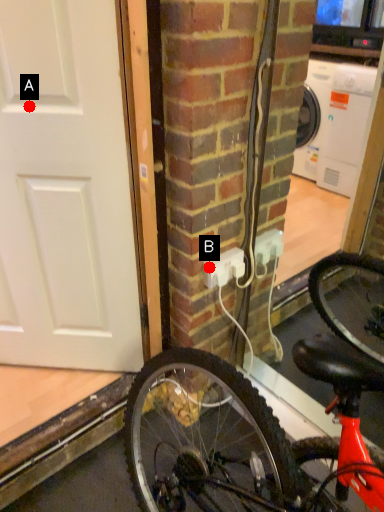
Question: Two points are circled on the image, labeled by A and B beside each circle. Which of the following is the farthest from the observer?

Choices:
 (A) A is further
 (B) B is further

Answer: (B)